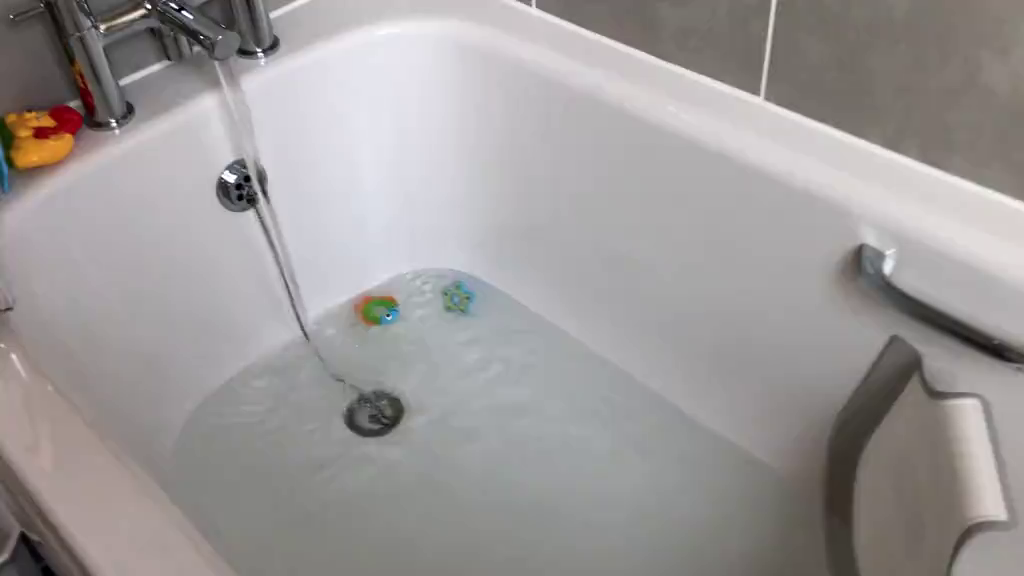
Find the location of a particular element. This screenshot has height=576, width=1024. space before bath handle bar is located at coordinates (662, 164).